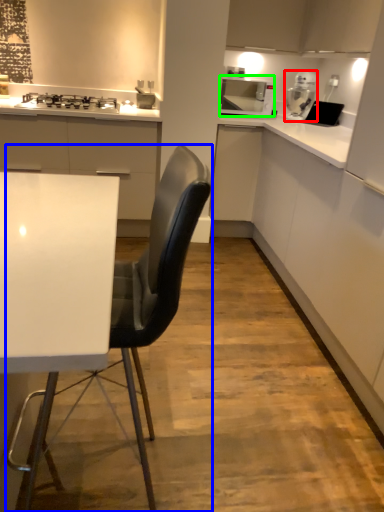
Question: Which object is positioned farthest from kitchen appliance (highlighted by a red box)? Select from chair (highlighted by a blue box) and home appliance (highlighted by a green box).

Choices:
 (A) chair
 (B) home appliance

Answer: (A)